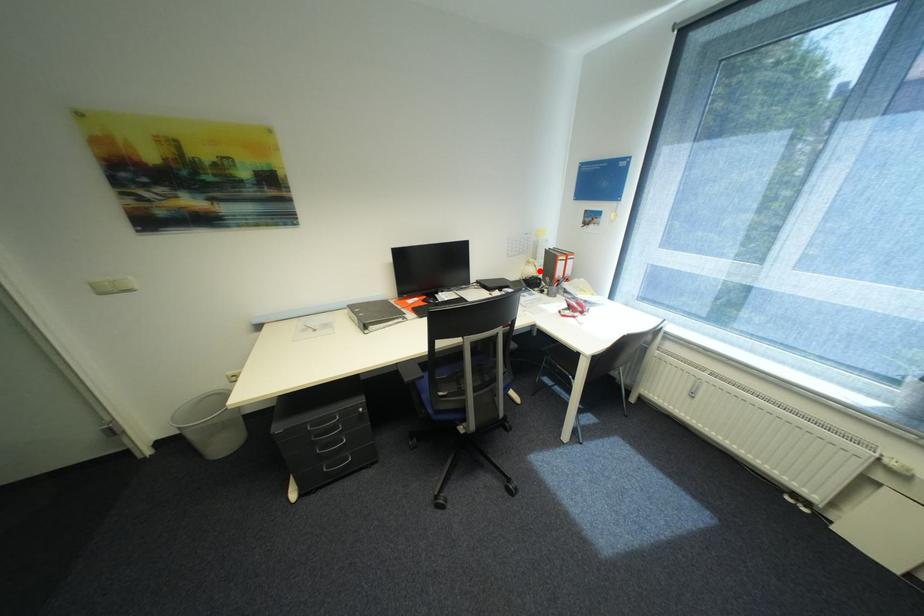
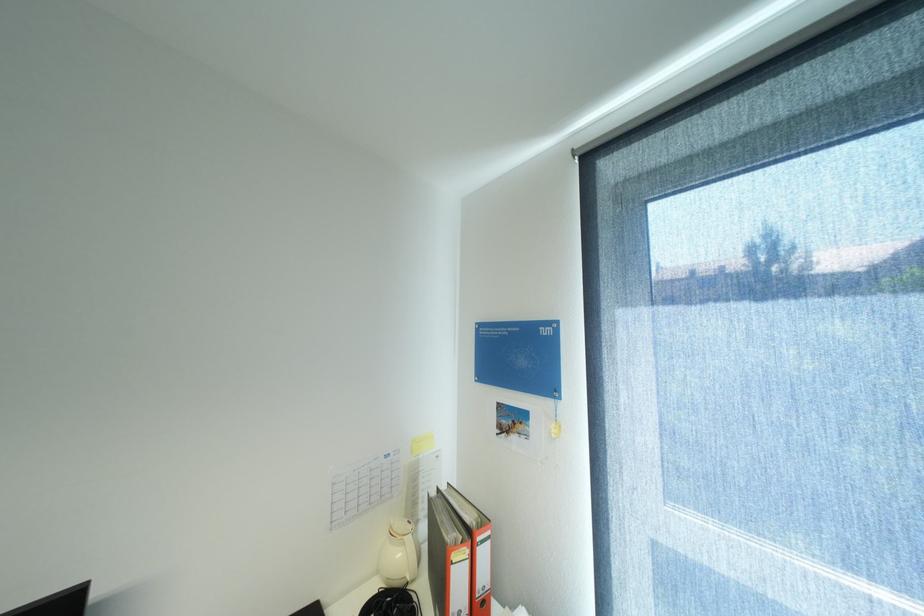
Where in the second image is the point corresponding to the highlighted location from the first image?

(407, 554)